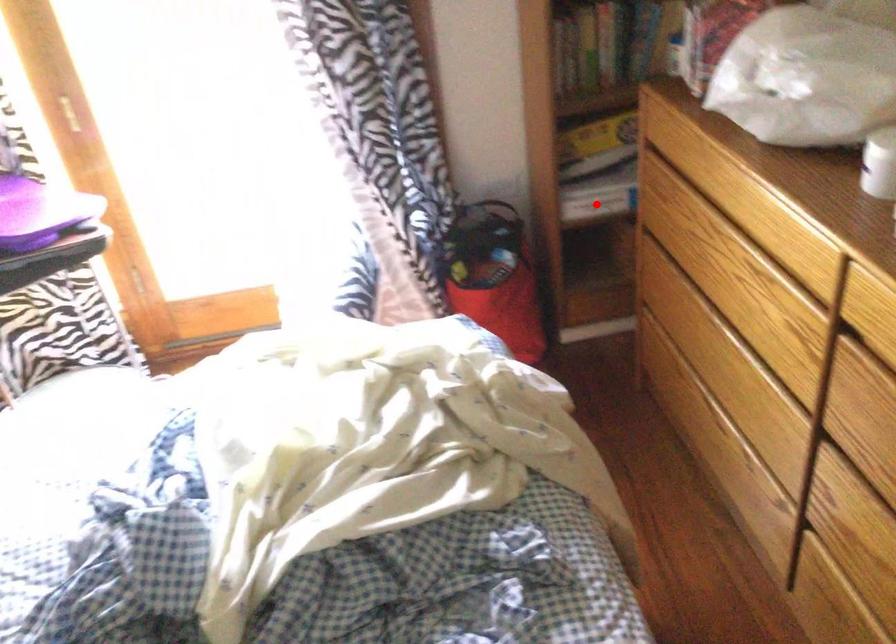
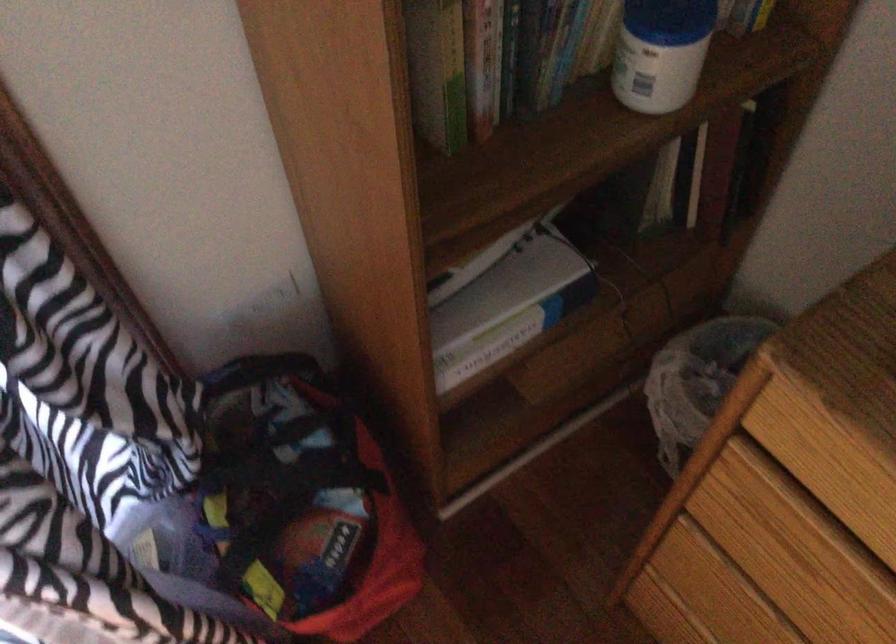
Question: I am providing you with two images of the same scene from different viewpoints. A red point is marked on the first image. Can you still see the location of the red point in image 2?

Choices:
 (A) Yes
 (B) No

Answer: (B)